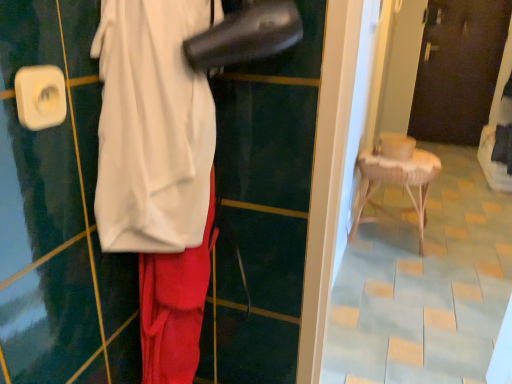
Question: Does dark brown wooden door at upper center appear on the right side of white fabric at center?

Choices:
 (A) yes
 (B) no

Answer: (A)

Question: Does dark brown wooden door at upper center have a larger size compared to white fabric at center?

Choices:
 (A) yes
 (B) no

Answer: (A)

Question: From a real-world perspective, is dark brown wooden door at upper center positioned under white fabric at center based on gravity?

Choices:
 (A) yes
 (B) no

Answer: (A)

Question: Could you tell me if dark brown wooden door at upper center is turned towards white fabric at center?

Choices:
 (A) no
 (B) yes

Answer: (B)

Question: Is dark brown wooden door at upper center smaller than white fabric at center?

Choices:
 (A) no
 (B) yes

Answer: (A)

Question: Looking at their shapes, would you say white fabric at center is wider or thinner than dark brown wooden door at upper center?

Choices:
 (A) thin
 (B) wide

Answer: (B)

Question: Is white fabric at center bigger or smaller than dark brown wooden door at upper center?

Choices:
 (A) big
 (B) small

Answer: (B)

Question: Considering the positions of point (150, 124) and point (480, 81), is point (150, 124) closer or farther from the camera than point (480, 81)?

Choices:
 (A) farther
 (B) closer

Answer: (B)

Question: Considering the relative positions of white fabric at center and dark brown wooden door at upper center in the image provided, is white fabric at center to the left or to the right of dark brown wooden door at upper center?

Choices:
 (A) left
 (B) right

Answer: (A)

Question: Considering the positions of woven wood stool at right and dark brown wooden door at upper center in the image, is woven wood stool at right taller or shorter than dark brown wooden door at upper center?

Choices:
 (A) short
 (B) tall

Answer: (A)

Question: Relative to dark brown wooden door at upper center, is woven wood stool at right in front or behind?

Choices:
 (A) front
 (B) behind

Answer: (A)

Question: From the image's perspective, is woven wood stool at right above or below dark brown wooden door at upper center?

Choices:
 (A) above
 (B) below

Answer: (B)

Question: Do you think woven wood stool at right is within dark brown wooden door at upper center, or outside of it?

Choices:
 (A) outside
 (B) inside

Answer: (A)

Question: In the image, is dark brown wooden door at upper center positioned in front of or behind white fabric at center?

Choices:
 (A) behind
 (B) front

Answer: (A)

Question: Is dark brown wooden door at upper center spatially inside white fabric at center, or outside of it?

Choices:
 (A) inside
 (B) outside

Answer: (B)